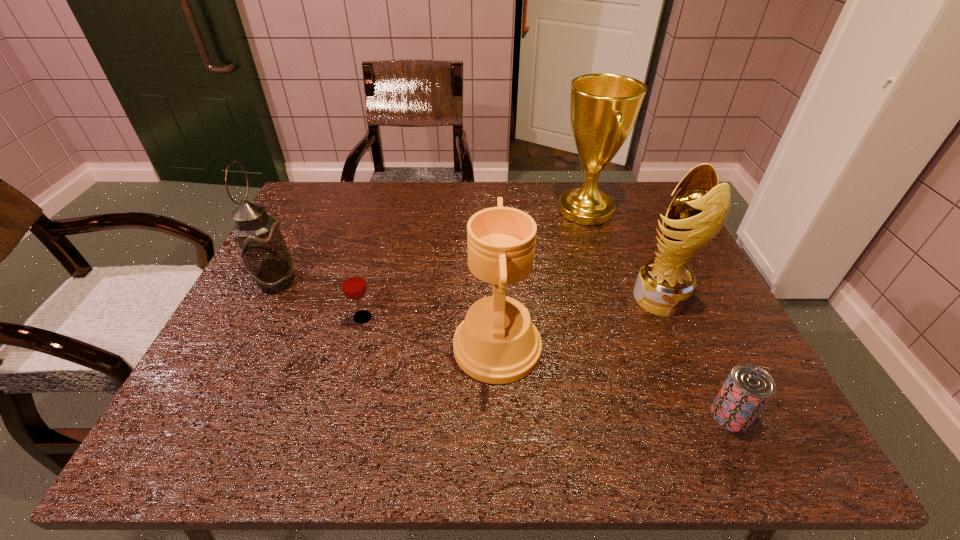
I want to click on free space at the far edge of the desktop, so click(446, 218).

Locate an element on the screen. The image size is (960, 540). free region at the near edge of the desktop is located at coordinates (345, 446).

Identify the location of vacant space at the left edge. (274, 387).

The image size is (960, 540). I want to click on vacant area at the right edge, so click(x=692, y=257).

Where is `vacant position at the far right corner of the desktop`? vacant position at the far right corner of the desktop is located at coordinates (635, 184).

Find the location of a particular element. free area in between the fourth object from right to left and the farthest award is located at coordinates (541, 279).

The image size is (960, 540). I want to click on unoccupied position between the fourth object from right to left and the farthest object, so click(541, 279).

The image size is (960, 540). Find the location of `empty space between the leftmost award and the oil lamp`. empty space between the leftmost award and the oil lamp is located at coordinates (387, 315).

Identify the location of blank region between the oil lamp and the glass. The image size is (960, 540). (320, 300).

Identify the location of free space between the farthest award and the oil lamp. The image size is (960, 540). (431, 246).